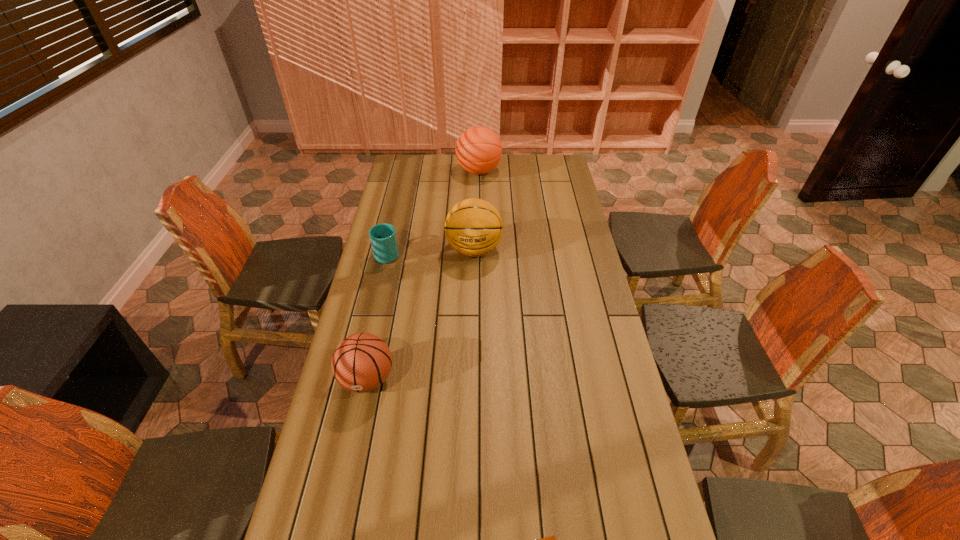
Where is `vacant space located 0.150m on the handle side of the cup`? The width and height of the screenshot is (960, 540). vacant space located 0.150m on the handle side of the cup is located at coordinates (395, 221).

You are a GUI agent. You are given a task and a screenshot of the screen. Output one action in this format:
    pyautogui.click(x=<x>, y=<y>)
    Task: Click on the object present at the far edge
    This screenshot has width=960, height=540.
    Given the screenshot: What is the action you would take?
    pyautogui.click(x=478, y=149)

I want to click on basketball present at the left edge, so click(x=361, y=362).

Locate an element on the screen. Image resolution: width=960 pixels, height=540 pixels. cup located at the left edge is located at coordinates (383, 239).

Locate an element on the screen. This screenshot has height=540, width=960. free space at the far edge is located at coordinates (513, 159).

Identify the location of free space at the right edge of the desktop. This screenshot has width=960, height=540. (567, 232).

You are a GUI agent. You are given a task and a screenshot of the screen. Output one action in this format:
    pyautogui.click(x=<x>, y=<y>)
    Task: Click on the vacant area at the far left corner of the desktop
    Image resolution: width=960 pixels, height=540 pixels.
    Given the screenshot: What is the action you would take?
    pyautogui.click(x=410, y=177)

Identify the location of vacant space that's between the second farthest basketball and the fourth tallest object. This screenshot has height=540, width=960. (431, 252).

Where is `empty location between the fourth farthest object and the farthest object`? empty location between the fourth farthest object and the farthest object is located at coordinates (423, 275).

Locate an element on the screen. This screenshot has width=960, height=540. free spot between the shortest basketball and the second farthest basketball is located at coordinates (420, 314).